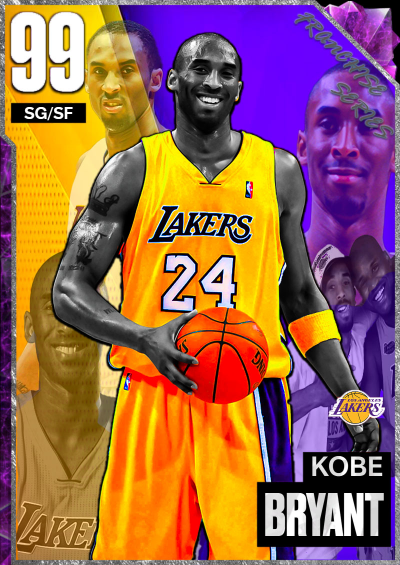
Image resolution: width=400 pixels, height=565 pixels. What are the coordinates of `picture of players on a poster` in the screenshot? It's located at click(x=346, y=288), click(x=380, y=277), click(x=203, y=73), click(x=57, y=351), click(x=120, y=82), click(x=345, y=131).